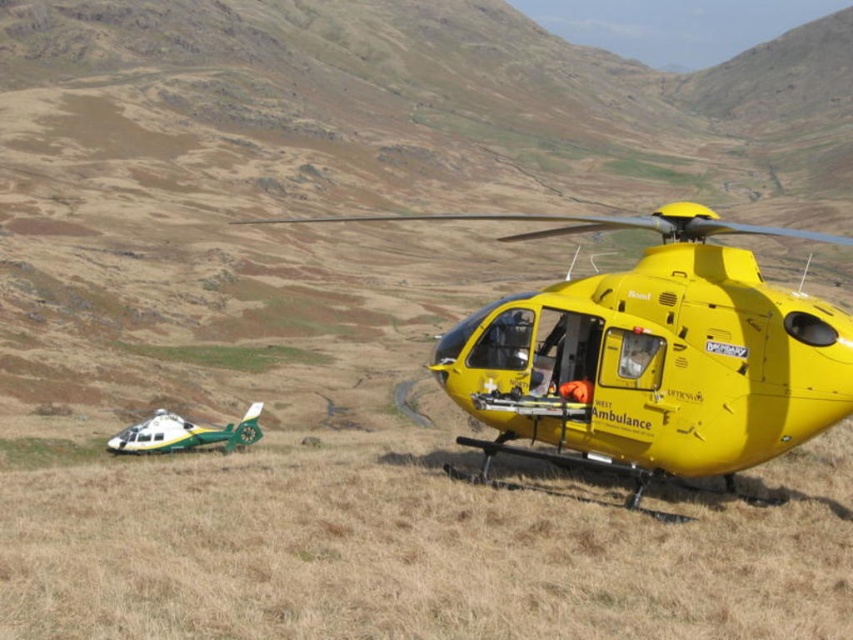
Question: Among these objects, which one is nearest to the camera?

Choices:
 (A) green grassy field at lower left
 (B) yellow matte helicopter at center
 (C) green matte helicopter at lower left

Answer: (B)

Question: Observing the image, what is the correct spatial positioning of yellow matte helicopter at center in reference to green grassy field at lower left?

Choices:
 (A) below
 (B) above

Answer: (B)

Question: Among these points, which one is nearest to the camera?

Choices:
 (A) (140, 433)
 (B) (125, 342)

Answer: (A)

Question: Which of these objects is positioned closest to the green matte helicopter at lower left?

Choices:
 (A) green grassy field at lower left
 (B) yellow matte helicopter at center

Answer: (A)

Question: Can you confirm if yellow matte helicopter at center is thinner than green grassy field at lower left?

Choices:
 (A) no
 (B) yes

Answer: (A)

Question: Can you confirm if green matte helicopter at lower left is smaller than green grassy field at lower left?

Choices:
 (A) no
 (B) yes

Answer: (A)